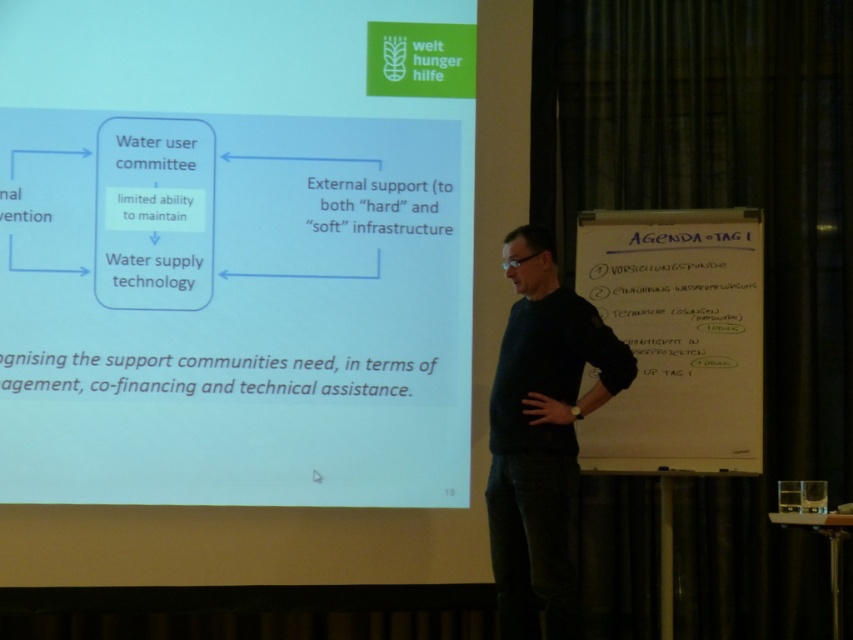
From the picture: You are a participant in the presentation and want to refer to the blue paper at upper center while pointing to the dark blue sweater at center. Can you reach both with your arm span? Assume your arm span is 60 inches.

The blue paper at upper center and dark blue sweater at center are 35.96 inches apart. Since your arm span is 60 inches, which is greater than 35.96 inches, you can reach both.

Looking at this image, where is the blue paper at upper center located in the slide?

The blue paper at upper center is located at point (234, 253).

Based on the scene description, can you determine if the blue paper at upper center is placed above or below the whiteboard at right?

The blue paper at upper center is positioned over whiteboard at right, meaning it is placed above the whiteboard at right.